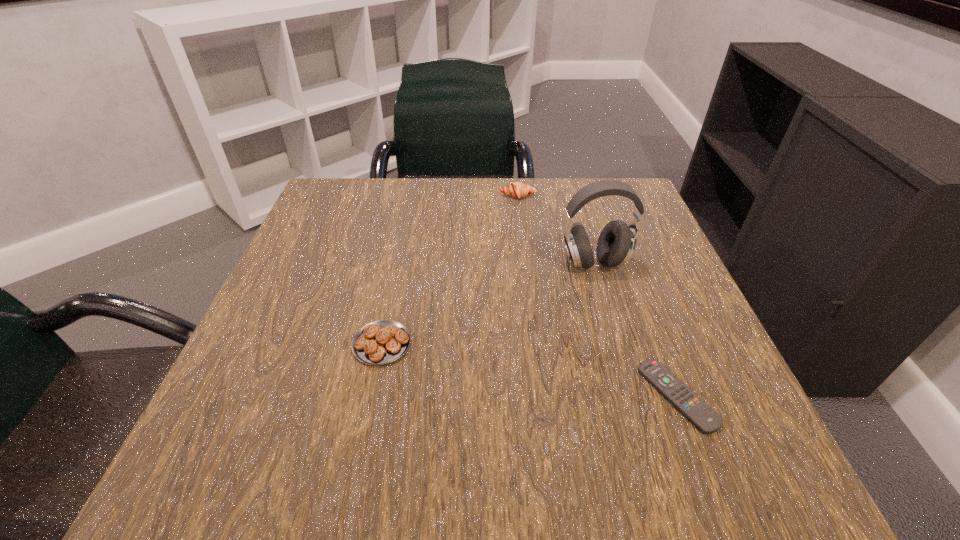
Where is `the tallest object`? Image resolution: width=960 pixels, height=540 pixels. the tallest object is located at coordinates (616, 243).

Identify the location of headset. The height and width of the screenshot is (540, 960). (616, 243).

Image resolution: width=960 pixels, height=540 pixels. What are the coordinates of `the second tallest object` in the screenshot? It's located at (518, 190).

I want to click on the farthest object, so click(x=518, y=190).

I want to click on the left pastry, so click(x=380, y=342).

Image resolution: width=960 pixels, height=540 pixels. What are the coordinates of `the shorter pastry` in the screenshot? It's located at (380, 342).

Find the location of a particular element. remote control is located at coordinates (701, 415).

The height and width of the screenshot is (540, 960). What are the coordinates of `vacant position located on the ear cups of the headset` in the screenshot? It's located at (640, 422).

This screenshot has width=960, height=540. In order to click on free region located 0.090m on the front-facing side of the third object from right to left in this screenshot , I will do `click(521, 222)`.

Locate an element on the screen. vacant space located on the back of the third tallest object is located at coordinates (406, 230).